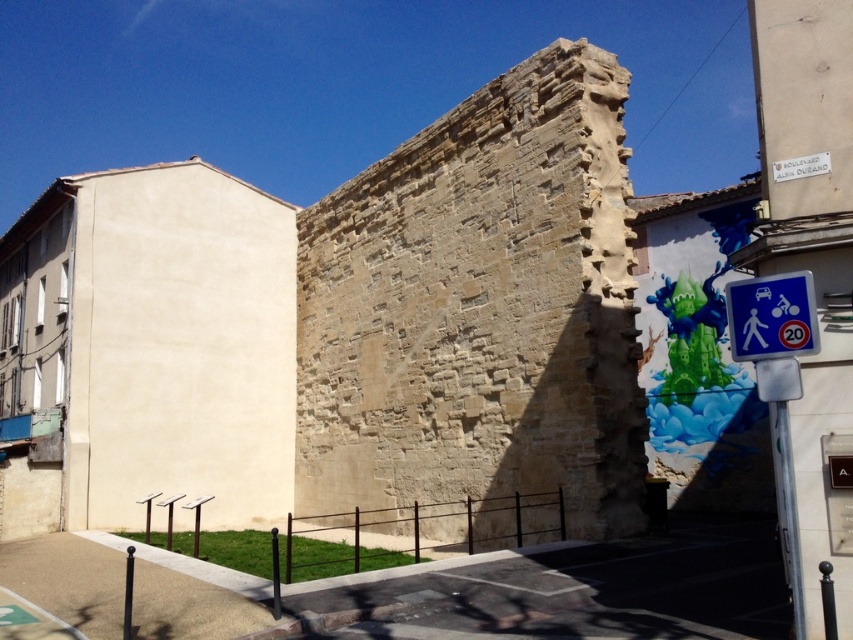
You are a city planner assessing the urban space. You need to determine if the brown stone wall at center can be seen from behind the blue plastic speed limit sign at right. Based on their heights, what is your conclusion?

The brown stone wall at center is taller than the blue plastic speed limit sign at right, so it would be visible from behind the sign.

You are standing 100 feet away from the stone wall in the center. You see a point at coordinates point (549, 129). Is this point closer to you than the stone wall?

The distance of point (549, 129) from viewer is 80.59 feet, so yes, the point is closer to you than the stone wall since it is 80.59 feet away while you are standing 100 feet away from the wall.